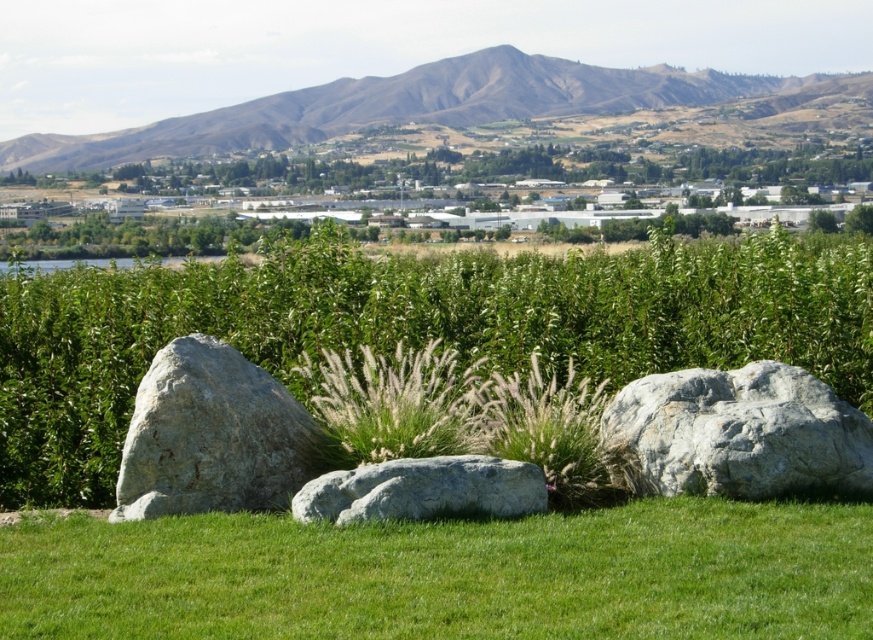
Question: Based on their relative distances, which object is farther from the brown/dry soil mountain at upper center?

Choices:
 (A) green grass at lower center
 (B) gray rough boulder at center-left
 (C) gray rock at center-right

Answer: (A)

Question: Which point is closer to the camera?

Choices:
 (A) (299, 124)
 (B) (491, 497)

Answer: (B)

Question: Among these points, which one is nearest to the camera?

Choices:
 (A) (279, 420)
 (B) (505, 582)

Answer: (B)

Question: Does green leafy hedge at center appear over gray rock at center-right?

Choices:
 (A) no
 (B) yes

Answer: (B)

Question: In this image, where is gray rough boulder at center-left located relative to gray smooth rock at center?

Choices:
 (A) right
 (B) left

Answer: (B)

Question: Can you confirm if green leafy hedge at center is positioned to the right of green grass at lower center?

Choices:
 (A) yes
 (B) no

Answer: (A)